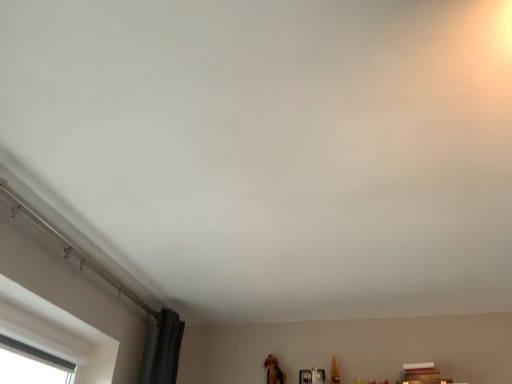
The image size is (512, 384). I want to click on white matte window at lower left, so click(56, 332).

What do you see at coordinates (56, 332) in the screenshot? I see `white matte window at lower left` at bounding box center [56, 332].

This screenshot has width=512, height=384. What are the coordinates of `white matte window at lower left` in the screenshot? It's located at (56, 332).